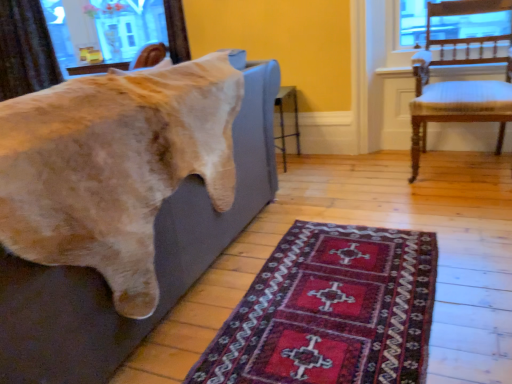
Where is `unoccupied space behind dark red woven rug at lower center`? The width and height of the screenshot is (512, 384). unoccupied space behind dark red woven rug at lower center is located at coordinates (345, 198).